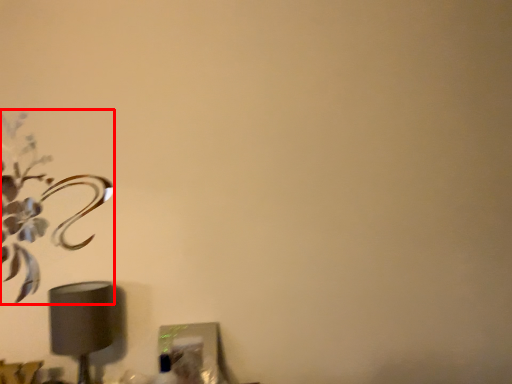
Question: Where is flower (annotated by the red box) located in relation to lamp in the image?

Choices:
 (A) left
 (B) right

Answer: (A)